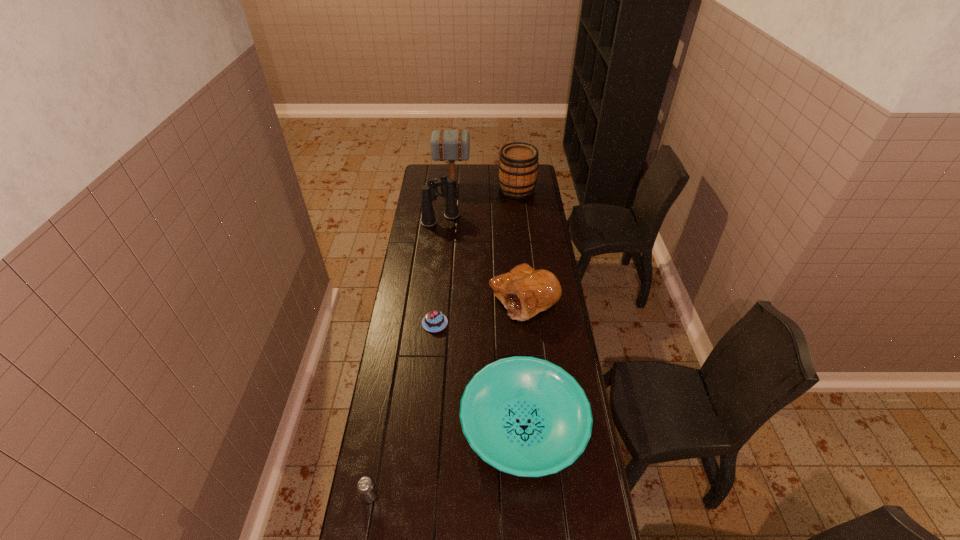
Locate an element on the screen. The image size is (960, 540). beer can at the left edge is located at coordinates (365, 486).

In order to click on chocolate cake at the left edge in this screenshot , I will do `click(434, 321)`.

You are a GUI agent. You are given a task and a screenshot of the screen. Output one action in this format:
    pyautogui.click(x=<x>, y=<y>)
    Task: Click on the cider located at the right edge
    The height and width of the screenshot is (540, 960).
    Given the screenshot: What is the action you would take?
    pyautogui.click(x=518, y=165)

This screenshot has height=540, width=960. In order to click on bread present at the right edge in this screenshot , I will do `click(524, 292)`.

Identify the location of dish located in the right edge section of the desktop. (525, 416).

At what (x,y) coordinates should I click in order to perform the action: click on object present at the far left corner. Please return your answer as a coordinate pair (x, y). Looking at the image, I should click on 446,145.

Identify the location of object at the far right corner. This screenshot has height=540, width=960. (518, 165).

Locate an element on the screen. This screenshot has height=540, width=960. blank space at the left edge is located at coordinates (414, 319).

The image size is (960, 540). I want to click on vacant region at the right edge, so click(557, 342).

The height and width of the screenshot is (540, 960). Identify the location of vacant space in between the mallet and the dish. (488, 305).